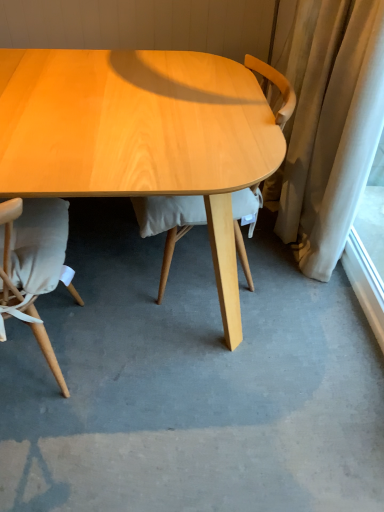
Question: From the image's perspective, is white sheer curtain at right located beneath matte beige chair at lower left, the 2th chair when ordered from right to left?

Choices:
 (A) no
 (B) yes

Answer: (A)

Question: Is the depth of white sheer curtain at right less than that of matte beige chair at lower left, the 2th chair when ordered from right to left?

Choices:
 (A) yes
 (B) no

Answer: (B)

Question: Does white sheer curtain at right have a lesser width compared to matte beige chair at lower left, the 1th chair in the left-to-right sequence?

Choices:
 (A) no
 (B) yes

Answer: (B)

Question: Is white sheer curtain at right located outside matte beige chair at lower left, the 2th chair when ordered from right to left?

Choices:
 (A) no
 (B) yes

Answer: (B)

Question: From a real-world perspective, is white sheer curtain at right over matte beige chair at lower left, the 1th chair in the left-to-right sequence?

Choices:
 (A) no
 (B) yes

Answer: (A)

Question: Is white sheer curtain at right placed right next to matte beige chair at lower left, the 2th chair when ordered from right to left?

Choices:
 (A) no
 (B) yes

Answer: (A)

Question: From a real-world perspective, is light wood chair at center, which is counted as the second chair, starting from the left, below white sheer curtain at right?

Choices:
 (A) no
 (B) yes

Answer: (A)

Question: Does light wood chair at center, the 1th chair positioned from the right, have a lesser height compared to white sheer curtain at right?

Choices:
 (A) yes
 (B) no

Answer: (B)

Question: Is the surface of light wood chair at center, the 1th chair positioned from the right, in direct contact with white sheer curtain at right?

Choices:
 (A) no
 (B) yes

Answer: (A)

Question: Can you confirm if light wood chair at center, the 1th chair positioned from the right, is wider than white sheer curtain at right?

Choices:
 (A) yes
 (B) no

Answer: (A)

Question: Is light wood chair at center, which is counted as the second chair, starting from the left, turned away from white sheer curtain at right?

Choices:
 (A) no
 (B) yes

Answer: (B)

Question: Would you say light wood chair at center, the 1th chair positioned from the right, contains white sheer curtain at right?

Choices:
 (A) yes
 (B) no

Answer: (B)

Question: Is matte beige chair at lower left, the 2th chair when ordered from right to left, bigger than white sheer curtain at right?

Choices:
 (A) no
 (B) yes

Answer: (B)